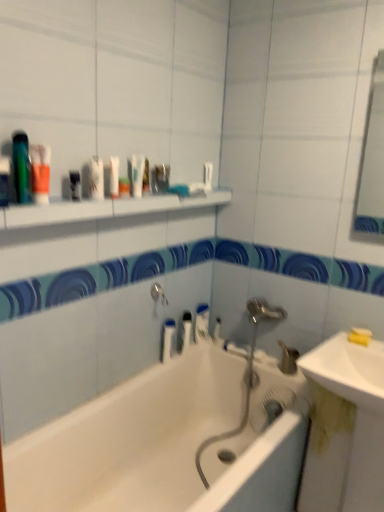
Question: Based on their positions, is white plastic bottle at upper center, the fourth mouthwash in the right-to-left sequence, located to the left or right of white glossy soap at center, the first toiletry when ordered from back to front?

Choices:
 (A) left
 (B) right

Answer: (A)

Question: From a real-world perspective, is white plastic bottle at upper center, the 2th mouthwash when ordered from top to bottom, above or below white glossy soap at center, acting as the first toiletry starting from the right?

Choices:
 (A) above
 (B) below

Answer: (A)

Question: Estimate the real-world distances between objects in this image. Which object is closer to the white glossy sink at lower right, the first sink from the top?

Choices:
 (A) white glossy toothpaste at center, arranged as the first toothpaste when viewed from the back
 (B) clear plastic bottle at center, the 7th mouthwash viewed from the left
 (C) white glossy shelf at upper center
 (D) yellow sponge at upper right, marked as the second soap in a top-to-bottom arrangement
 (E) white glossy toothpaste at upper center, which is the 1th toothpaste in front-to-back order

Answer: (D)

Question: Which object is the closest to the white plastic bottle at upper center, the 2th mouthwash when ordered from top to bottom?

Choices:
 (A) yellow sponge at upper right, marked as the second soap in a top-to-bottom arrangement
 (B) white glossy toothpaste at center, arranged as the first toothpaste when ordered from the bottom
 (C) translucent orange bottle at upper left, the 7th mouthwash in the back-to-front sequence
 (D) yellow matte soap at right, the first soap when ordered from top to bottom
 (E) white glossy sink at lower right, which is the 2th sink from top to bottom

Answer: (C)